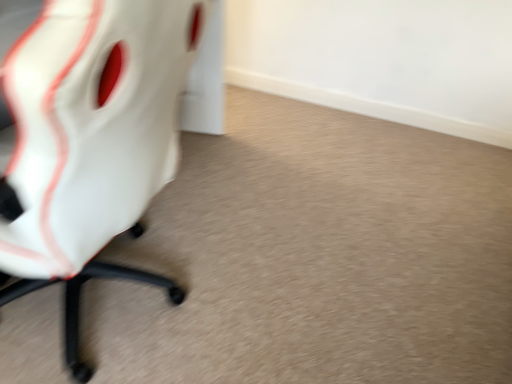
What do you see at coordinates (90, 140) in the screenshot? I see `white matte chair at left` at bounding box center [90, 140].

Find the location of `white matte chair at left`. white matte chair at left is located at coordinates (90, 140).

I want to click on white matte chair at left, so click(x=90, y=140).